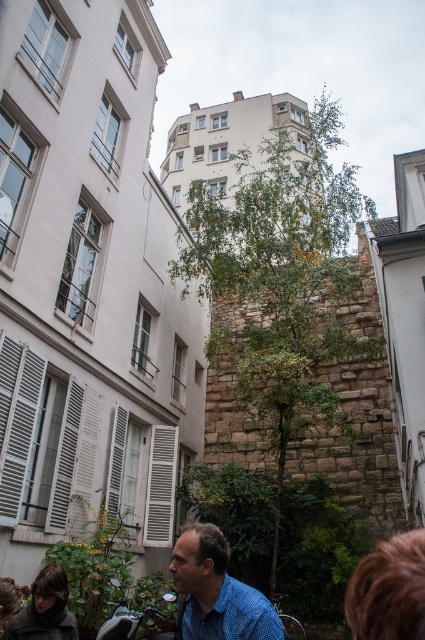
Who is more forward, (173, 566) or (141, 611)?

Positioned in front is point (173, 566).

Is blue checkered shirt at lower center above shiny chrome motorcycle at lower left?

Correct, blue checkered shirt at lower center is located above shiny chrome motorcycle at lower left.

Which is behind, point (215, 525) or point (118, 582)?

The point (215, 525) is behind.

Where is `blue checkered shirt at lower center`? The image size is (425, 640). blue checkered shirt at lower center is located at coordinates (217, 592).

Between green leafy tree at center and blue checkered shirt at lower center, which one is positioned higher?

green leafy tree at center is higher up.

Can you confirm if green leafy tree at center is positioned to the left of blue checkered shirt at lower center?

In fact, green leafy tree at center is to the right of blue checkered shirt at lower center.

What do you see at coordinates (278, 276) in the screenshot? This screenshot has width=425, height=640. I see `green leafy tree at center` at bounding box center [278, 276].

I want to click on green leafy tree at center, so click(x=278, y=276).

Does green leafy tree at center have a greater height compared to shiny chrome motorcycle at lower left?

Yes.

Is point (197, 268) positioned before point (116, 620)?

No.

Locate an element on the screen. This screenshot has height=640, width=425. green leafy tree at center is located at coordinates (278, 276).